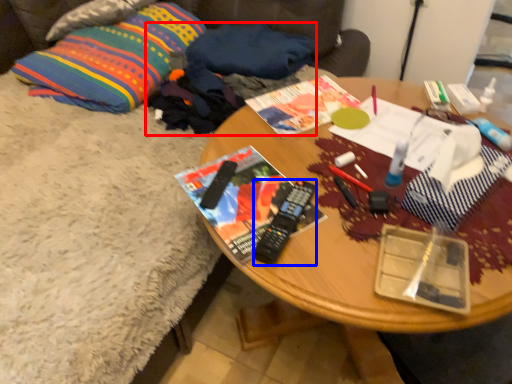
Question: Which object is further to the camera taking this photo, clothing (highlighted by a red box) or remote control (highlighted by a blue box)?

Choices:
 (A) clothing
 (B) remote control

Answer: (A)